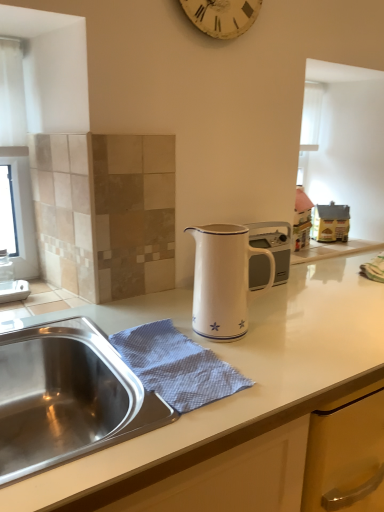
Question: Considering the relative sizes of white enamel jug at center and white glossy pitcher at center in the image provided, is white enamel jug at center wider than white glossy pitcher at center?

Choices:
 (A) no
 (B) yes

Answer: (A)

Question: Can you see white enamel jug at center touching white glossy pitcher at center?

Choices:
 (A) yes
 (B) no

Answer: (B)

Question: Is white enamel jug at center smaller than white glossy pitcher at center?

Choices:
 (A) no
 (B) yes

Answer: (B)

Question: Does white enamel jug at center turn towards white glossy pitcher at center?

Choices:
 (A) no
 (B) yes

Answer: (A)

Question: Considering the relative sizes of white enamel jug at center and white glossy pitcher at center in the image provided, is white enamel jug at center shorter than white glossy pitcher at center?

Choices:
 (A) yes
 (B) no

Answer: (A)

Question: Considering the relative positions of white enamel jug at center and white glossy pitcher at center in the image provided, is white enamel jug at center to the left of white glossy pitcher at center from the viewer's perspective?

Choices:
 (A) no
 (B) yes

Answer: (B)

Question: Considering the relative positions of white glossy pitcher at center and blue textured cloth at sink in the image provided, is white glossy pitcher at center in front of blue textured cloth at sink?

Choices:
 (A) no
 (B) yes

Answer: (A)

Question: Can you confirm if white glossy pitcher at center is positioned to the right of blue textured cloth at sink?

Choices:
 (A) no
 (B) yes

Answer: (B)

Question: From a real-world perspective, is white glossy pitcher at center positioned under blue textured cloth at sink based on gravity?

Choices:
 (A) yes
 (B) no

Answer: (A)

Question: Is white glossy pitcher at center with blue textured cloth at sink?

Choices:
 (A) yes
 (B) no

Answer: (B)

Question: Is white glossy pitcher at center turned away from blue textured cloth at sink?

Choices:
 (A) yes
 (B) no

Answer: (B)

Question: Is blue textured cloth at sink a part of white glossy pitcher at center?

Choices:
 (A) yes
 (B) no

Answer: (B)

Question: From the image's perspective, is white textured clock at upper center on blue textured cloth at sink?

Choices:
 (A) yes
 (B) no

Answer: (A)